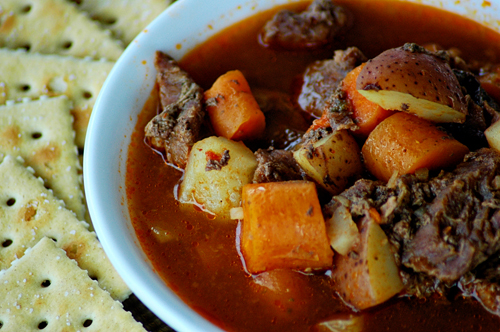
Locate an element on the screen. The height and width of the screenshot is (332, 500). table is located at coordinates (143, 317).